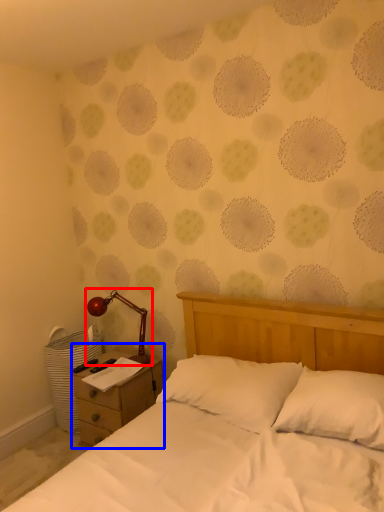
Question: Which point is further to the camera, lamp (highlighted by a red box) or nightstand (highlighted by a blue box)?

Choices:
 (A) lamp
 (B) nightstand

Answer: (A)